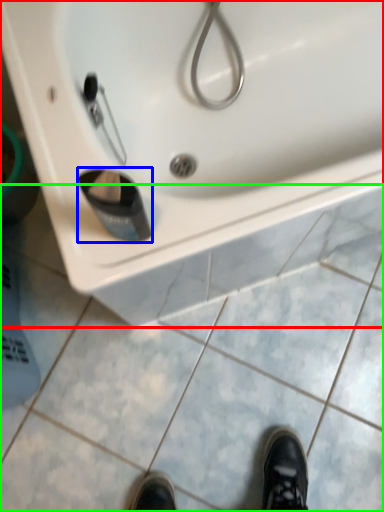
Question: Which object is the closest to the sink (highlighted by a red box)? Choose among these: liquid (highlighted by a blue box) or tile (highlighted by a green box).

Choices:
 (A) liquid
 (B) tile

Answer: (A)